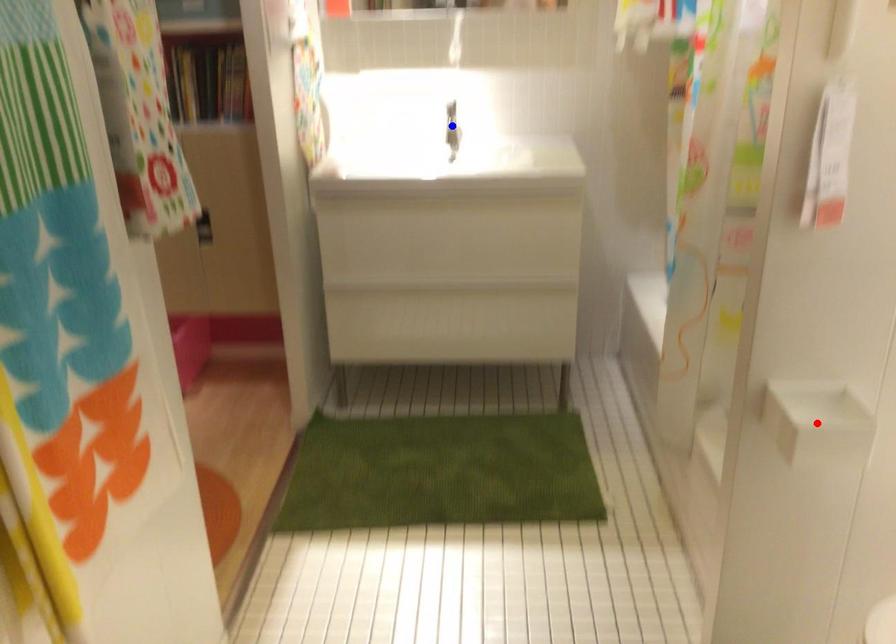
Question: Which of the two points in the image is closer to the camera?

Choices:
 (A) Blue point is closer.
 (B) Red point is closer.

Answer: (B)